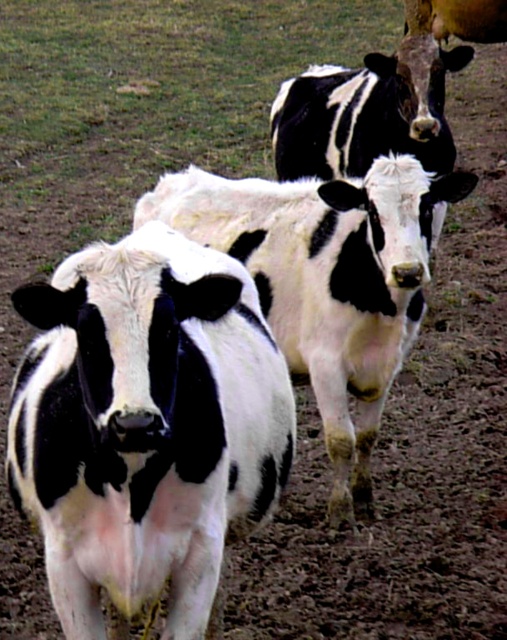
Question: Is black and white fur at center thinner than black and white cow at center?

Choices:
 (A) no
 (B) yes

Answer: (B)

Question: Does black and white fur at center appear under black and white cow at center?

Choices:
 (A) yes
 (B) no

Answer: (A)

Question: Does black and white fur at center appear over black and white cow at center?

Choices:
 (A) no
 (B) yes

Answer: (A)

Question: Which of the following is the closest to the observer?

Choices:
 (A) (215, 563)
 (B) (358, 272)

Answer: (A)